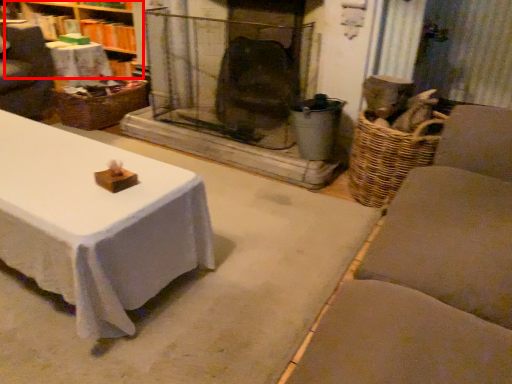
Question: Observing the image, what is the correct spatial positioning of bookshelf (annotated by the red box) in reference to basket?

Choices:
 (A) left
 (B) right

Answer: (A)